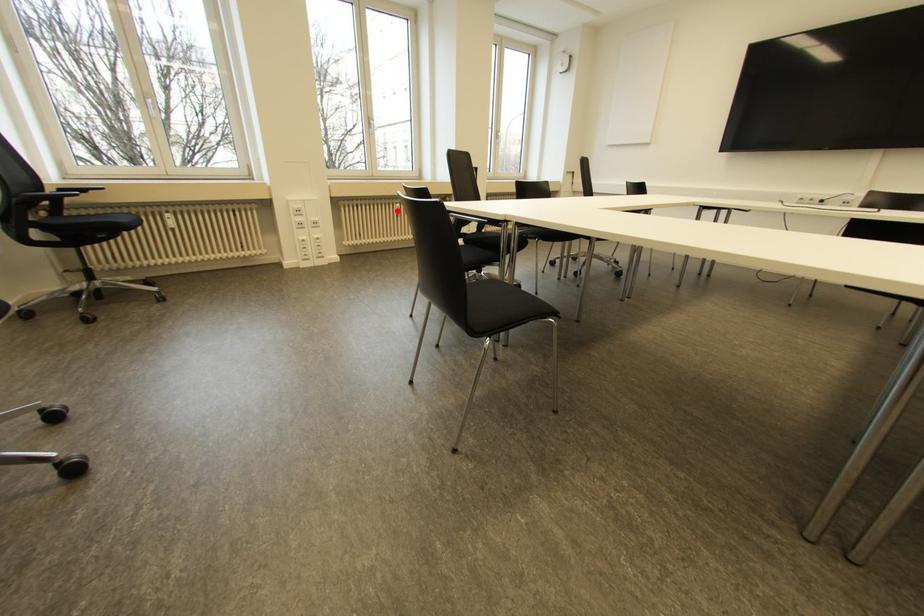
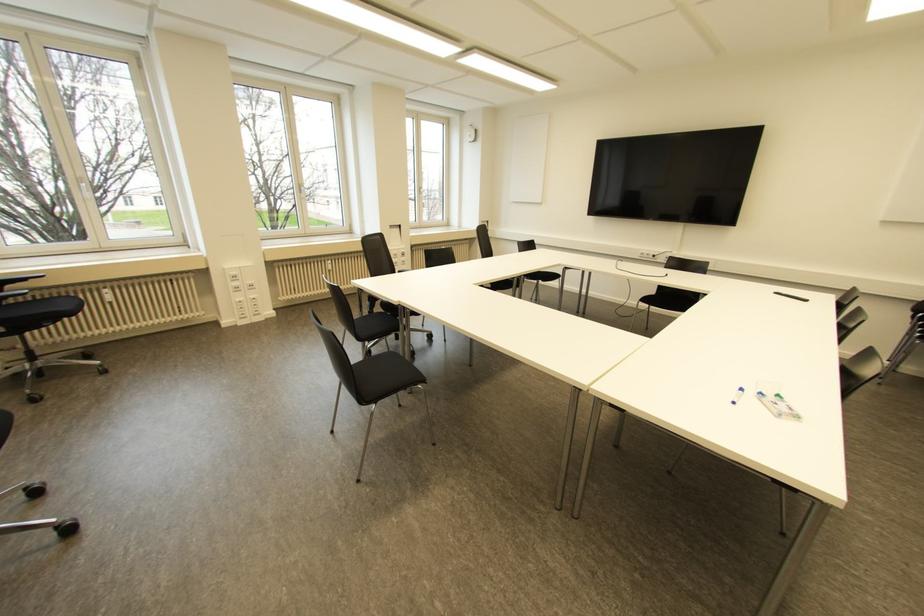
Where in the second image is the point corresponding to the highlighted location from the first image?

(330, 267)